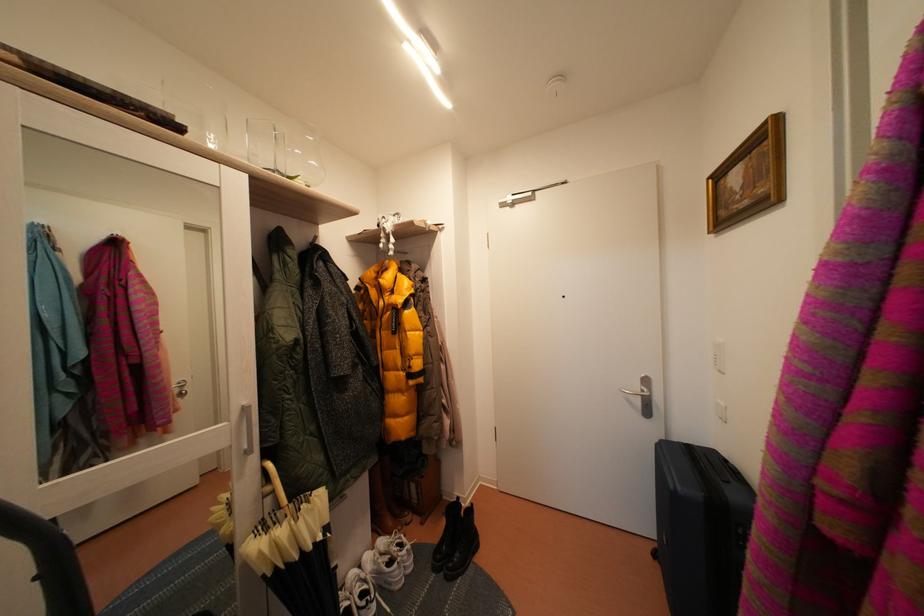
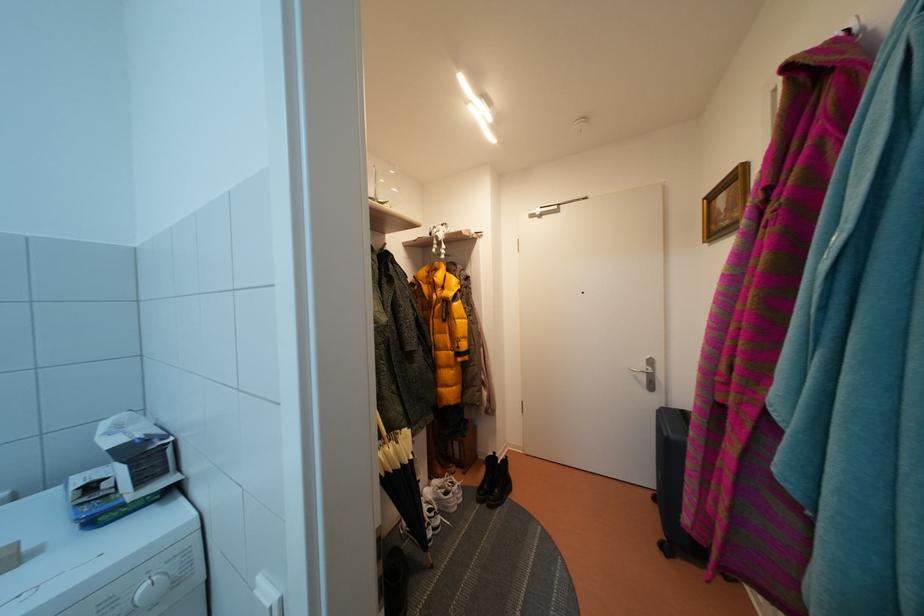
In the second image, find the point that corresponds to point (662, 561) in the first image.

(662, 505)